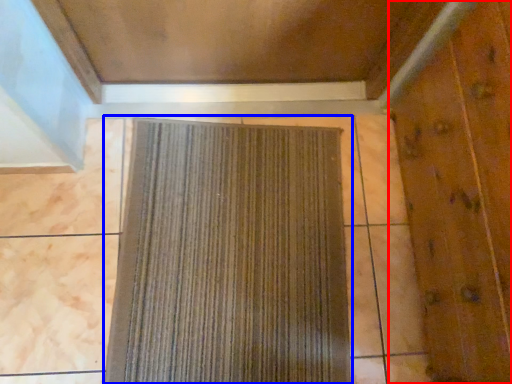
Question: Among these objects, which one is nearest to the camera, elevator door (highlighted by a red box) or curtain (highlighted by a blue box)?

Choices:
 (A) elevator door
 (B) curtain

Answer: (A)